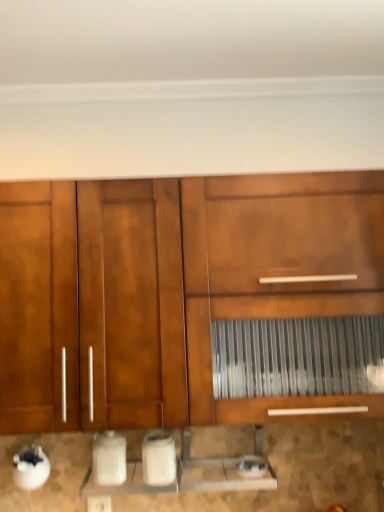
Question: Is satin silver toaster at lower center, which is counted as the 1th appliance, starting from the right, wider than white plastic electric outlet at lower center?

Choices:
 (A) no
 (B) yes

Answer: (B)

Question: Is satin silver toaster at lower center, which is counted as the 1th appliance, starting from the right, bigger than white plastic electric outlet at lower center?

Choices:
 (A) no
 (B) yes

Answer: (B)

Question: Can you confirm if satin silver toaster at lower center, which is counted as the 1th appliance, starting from the right, is positioned to the right of white plastic electric outlet at lower center?

Choices:
 (A) yes
 (B) no

Answer: (A)

Question: Considering the relative sizes of satin silver toaster at lower center, which is counted as the 1th appliance, starting from the right, and white plastic electric outlet at lower center in the image provided, is satin silver toaster at lower center, which is counted as the 1th appliance, starting from the right, smaller than white plastic electric outlet at lower center?

Choices:
 (A) yes
 (B) no

Answer: (B)

Question: From a real-world perspective, is satin silver toaster at lower center, which is counted as the 1th appliance, starting from the right, below white plastic electric outlet at lower center?

Choices:
 (A) yes
 (B) no

Answer: (B)

Question: Considering the relative sizes of satin silver toaster at lower center, which is the 3th appliance from left to right, and white plastic electric outlet at lower center in the image provided, is satin silver toaster at lower center, which is the 3th appliance from left to right, thinner than white plastic electric outlet at lower center?

Choices:
 (A) no
 (B) yes

Answer: (A)

Question: Could matte wood cabinet at center be considered to be inside white glossy toaster at lower center, which is counted as the second appliance, starting from the right?

Choices:
 (A) no
 (B) yes

Answer: (A)

Question: Is white glossy toaster at lower center, which is counted as the second appliance, starting from the right, at the left side of matte wood cabinet at center?

Choices:
 (A) no
 (B) yes

Answer: (B)

Question: Is white glossy toaster at lower center, which is counted as the second appliance, starting from the right, to the right of matte wood cabinet at center from the viewer's perspective?

Choices:
 (A) no
 (B) yes

Answer: (A)

Question: Considering the relative positions of white glossy toaster at lower center, which appears as the 2th appliance when viewed from the left, and matte wood cabinet at center in the image provided, is white glossy toaster at lower center, which appears as the 2th appliance when viewed from the left, behind matte wood cabinet at center?

Choices:
 (A) yes
 (B) no

Answer: (A)

Question: Is white glossy toaster at lower center, which appears as the 2th appliance when viewed from the left, positioned far away from matte wood cabinet at center?

Choices:
 (A) yes
 (B) no

Answer: (B)

Question: Can you confirm if white glossy toaster at lower center, which appears as the 2th appliance when viewed from the left, is wider than matte wood cabinet at center?

Choices:
 (A) no
 (B) yes

Answer: (A)

Question: Is white plastic electric outlet at lower center outside matte wood cabinet at center?

Choices:
 (A) no
 (B) yes

Answer: (B)